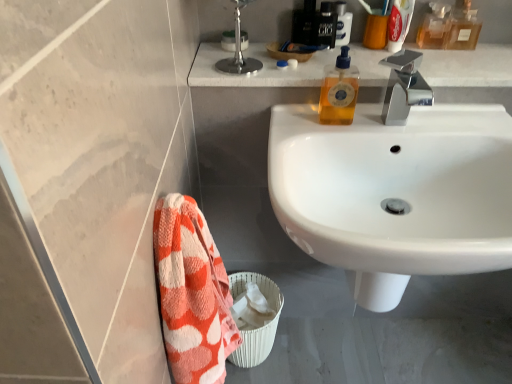
Find the location of `vacant space that's between yellow liquid soap at upper right, which appears as the 3th toiletry when viewed from the top, and polished chrome faucet at upper right`. vacant space that's between yellow liquid soap at upper right, which appears as the 3th toiletry when viewed from the top, and polished chrome faucet at upper right is located at coordinates (364, 123).